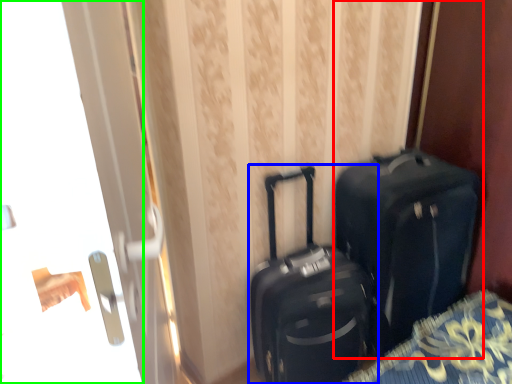
Question: Considering the real-world distances, which object is closest to luggage and bags (highlighted by a red box)? suitcase (highlighted by a blue box) or screen door (highlighted by a green box).

Choices:
 (A) suitcase
 (B) screen door

Answer: (A)